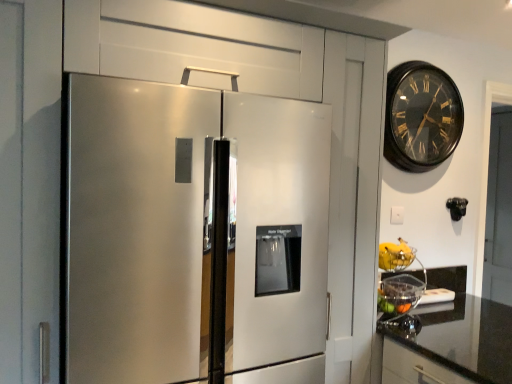
Question: Considering their positions, is stainless steel refrigerator at left located in front of or behind black wooden clock at upper right?

Choices:
 (A) front
 (B) behind

Answer: (A)

Question: From a real-world perspective, is stainless steel refrigerator at left above or below black wooden clock at upper right?

Choices:
 (A) below
 (B) above

Answer: (A)

Question: Which is nearer to the black wooden clock at upper right?

Choices:
 (A) black granite countertop at lower right
 (B) stainless steel refrigerator at left
 (C) yellow matte bananas at right

Answer: (C)

Question: Which of these objects is positioned closest to the yellow matte bananas at right?

Choices:
 (A) black wooden clock at upper right
 (B) stainless steel refrigerator at left
 (C) black granite countertop at lower right

Answer: (C)